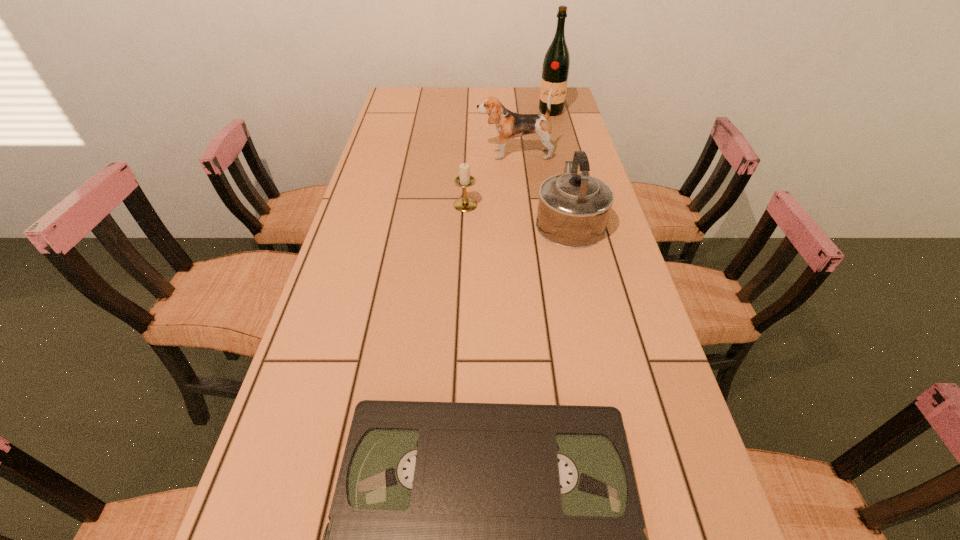
Find the location of `vacant area at the right edge of the desktop`. vacant area at the right edge of the desktop is located at coordinates (620, 379).

You are a GUI agent. You are given a task and a screenshot of the screen. Output one action in this format:
    pyautogui.click(x=<x>, y=<y>)
    Task: Click on the free space at the far left corner of the desktop
    The image size is (960, 540).
    Given the screenshot: What is the action you would take?
    pyautogui.click(x=420, y=107)

I want to click on vacant area that lies between the puppy and the fourth tallest object, so click(490, 179).

The image size is (960, 540). Identify the location of free space between the second farthest object and the candle holder. (490, 179).

You are a GUI agent. You are given a task and a screenshot of the screen. Output one action in this format:
    pyautogui.click(x=<x>, y=<y>)
    Task: Click on the vacant region between the fourth tallest object and the kettle
    
    Given the screenshot: What is the action you would take?
    pyautogui.click(x=517, y=212)

Locate an element on the screen. vacant space in between the kettle and the second shortest object is located at coordinates (517, 212).

At what (x,y) coordinates should I click in order to perform the action: click on vacant region between the puppy and the second shortest object. Please return your answer as a coordinate pair (x, y). The image size is (960, 540). Looking at the image, I should click on (490, 179).

Identify which object is located as the second nearest to the nearest object. Please provide its 2D coordinates. Your answer should be formatted as a tuple, i.e. [(x, y)], where the tuple contains the x and y coordinates of a point satisfying the conditions above.

[(465, 204)]

Identify the location of object that stands as the third closest to the second shortest object. This screenshot has width=960, height=540. pos(556,64).

The width and height of the screenshot is (960, 540). I want to click on free location that satisfies the following two spatial constraints: 1. with the spout at the front of the kettle; 2. at the face of the puppy, so click(554, 154).